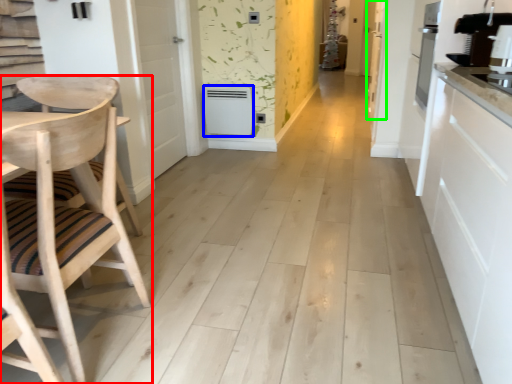
Question: Which is nearer to the chair (highlighted by a red box)? appliance (highlighted by a blue box) or door (highlighted by a green box).

Choices:
 (A) appliance
 (B) door

Answer: (A)